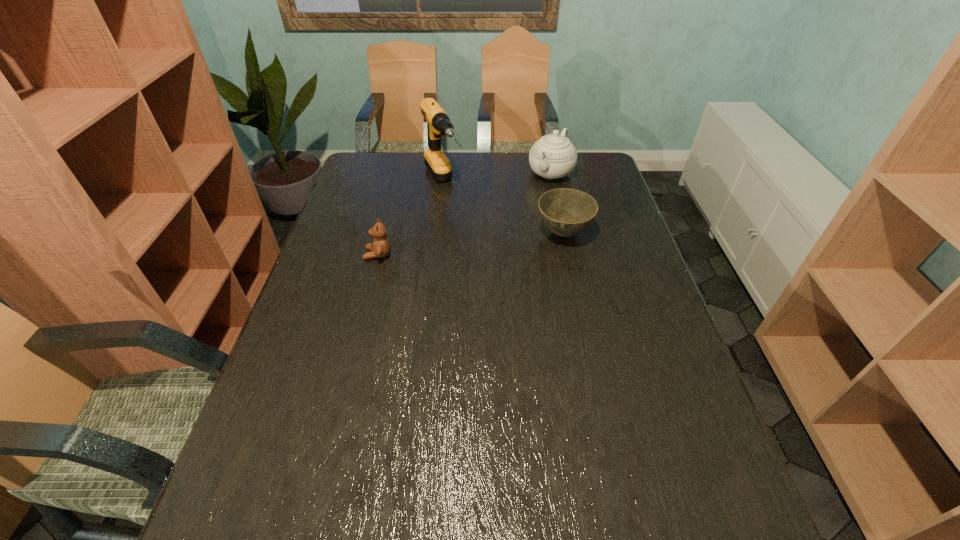
The image size is (960, 540). I want to click on vacant region between the second tallest object and the second object from left to right, so click(497, 178).

In order to click on vacant space that is in between the second tallest object and the leftmost object in this screenshot , I will do `click(465, 214)`.

Find the location of a particular element. This screenshot has height=540, width=960. unoccupied area between the leftmost object and the tallest object is located at coordinates (411, 219).

At what (x,y) coordinates should I click in order to perform the action: click on blank region between the third object from right to left and the teddy bear. Please return your answer as a coordinate pair (x, y). Looking at the image, I should click on (411, 219).

Identify which object is the second closest to the teddy bear. Please provide its 2D coordinates. Your answer should be formatted as a tuple, i.e. [(x, y)], where the tuple contains the x and y coordinates of a point satisfying the conditions above.

[(566, 212)]

Identify which object is located as the third nearest to the bowl. Please provide its 2D coordinates. Your answer should be formatted as a tuple, i.e. [(x, y)], where the tuple contains the x and y coordinates of a point satisfying the conditions above.

[(380, 248)]